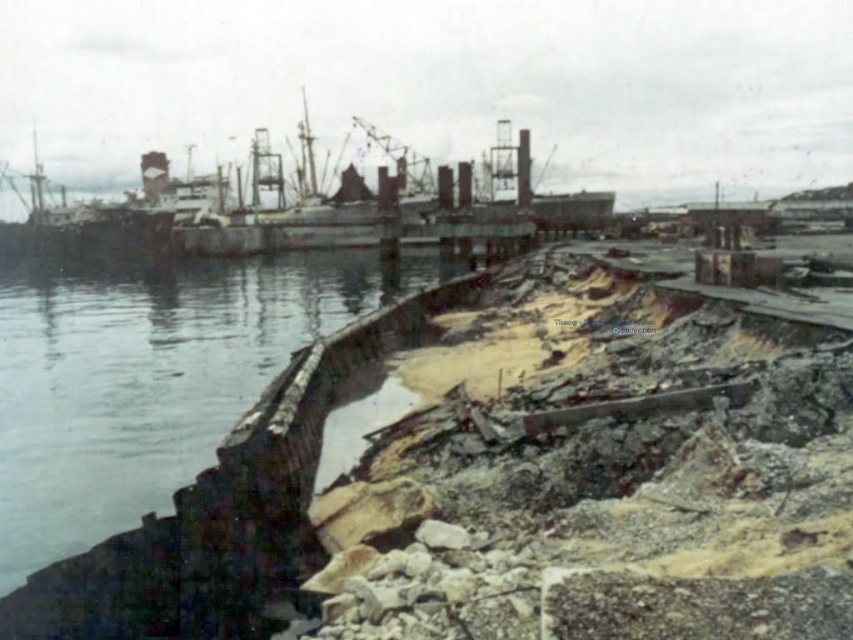
You are a photographer positioned at the edge of the harbor. You want to capture a photo of both the rusty metallic water at lower left and the rusty metal ship at center. Which object should you focus on first to ensure both are in sharp focus?

You should focus on the rusty metallic water at lower left first because it is closer to the viewer than the rusty metal ship at center. By focusing on the closer object, the ship will still be within the depth of field and remain sharp in the photo.

You are a harbor inspector assessing the scene. You notice the rusty metallic water at lower left and the rusty metal ship at center. According to the spatial arrangement, which object is positioned to the right of the other?

The rusty metallic water at lower left is to the right of the rusty metal ship at center.